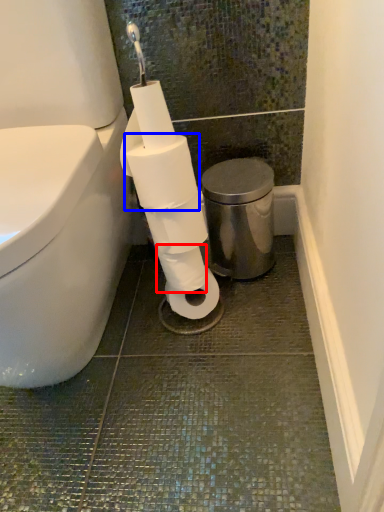
Question: Which object is further to the camera taking this photo, toilet paper (highlighted by a red box) or toilet paper (highlighted by a blue box)?

Choices:
 (A) toilet paper
 (B) toilet paper

Answer: (A)